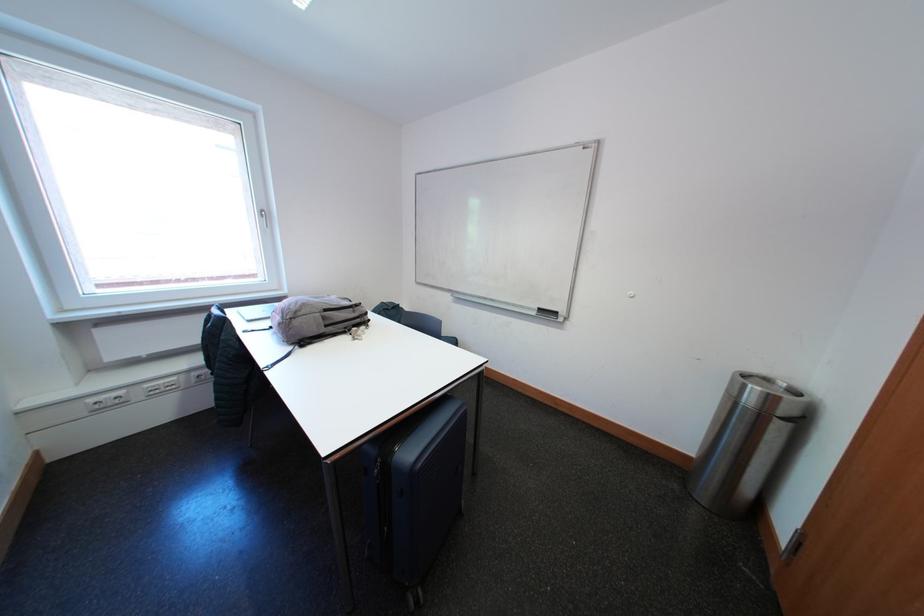
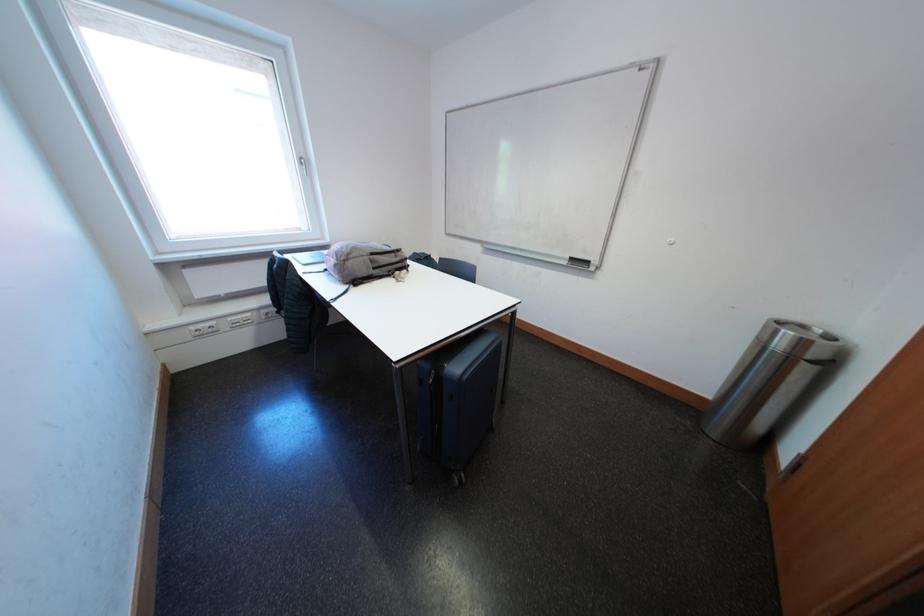
Locate, in the second image, the point that corresponds to [543,317] in the first image.

(575, 267)